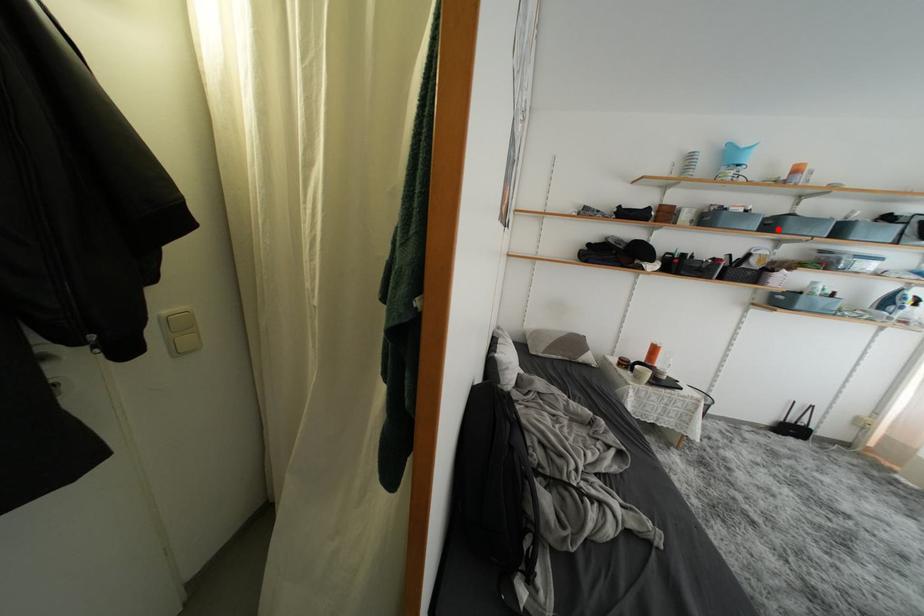
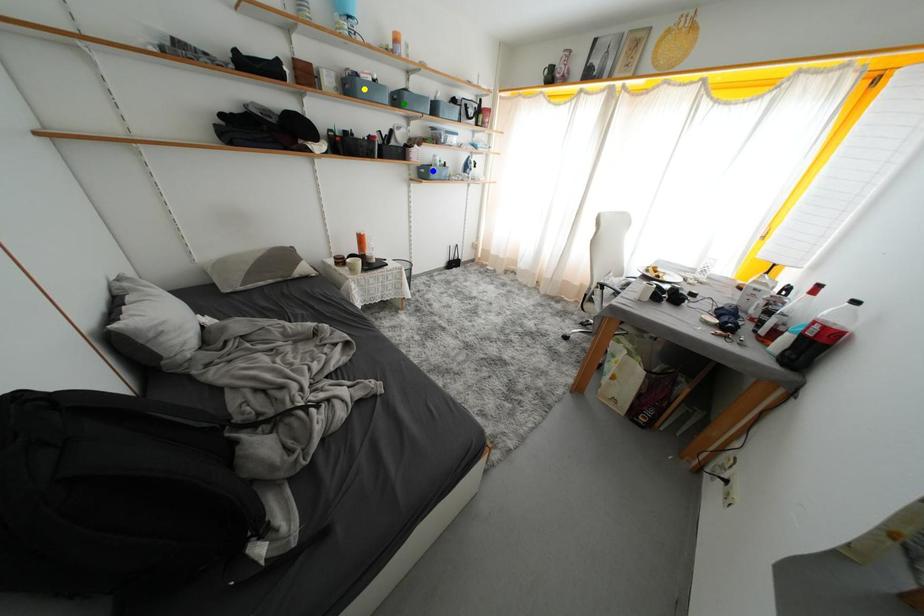
Question: I am providing you with two images of the same scene from different viewpoints. A red point is marked on the first image. You are given multiple points on the second image. Which spot in image 2 lines up with the point in image 1?

Choices:
 (A) blue point
 (B) yellow point
 (C) green point

Answer: (C)